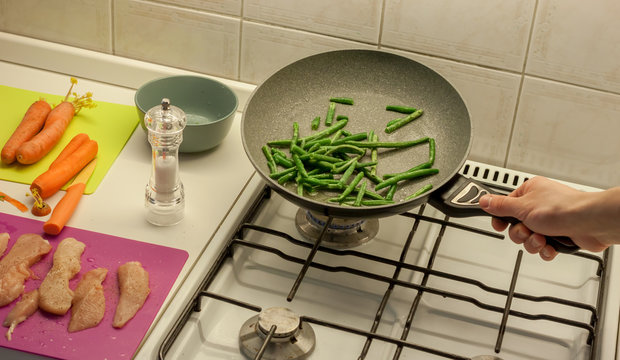
I want to click on tile, so click(539, 56), click(364, 16), click(221, 6), click(87, 22), click(266, 44), click(204, 54), click(495, 88), click(578, 114).